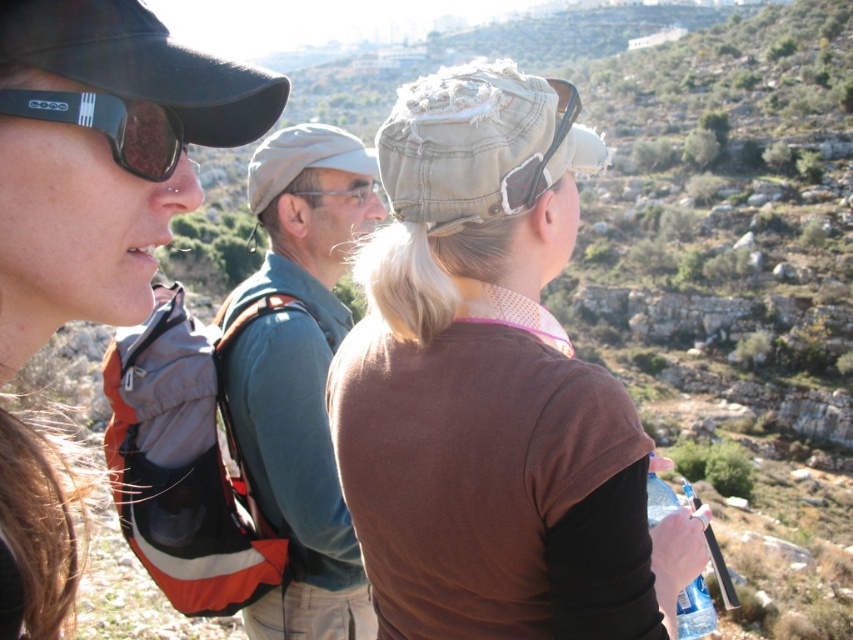
Question: Which of these objects is positioned closest to the light gray fabric cap at center?

Choices:
 (A) clear plastic bottle at lower right
 (B) brown cotton shirt at center
 (C) sunglasses at left

Answer: (B)

Question: Which point is farther from the camera taking this photo?

Choices:
 (A) (357, 611)
 (B) (4, 460)

Answer: (A)

Question: Which object is farther from the camera taking this photo?

Choices:
 (A) clear plastic bottle at lower right
 (B) light gray fabric cap at center

Answer: (B)

Question: Does brown cotton shirt at center appear on the right side of clear plastic bottle at lower right?

Choices:
 (A) no
 (B) yes

Answer: (A)

Question: Observing the image, what is the correct spatial positioning of light gray fabric cap at center in reference to clear plastic bottle at lower right?

Choices:
 (A) right
 (B) left

Answer: (B)

Question: Where is brown cotton shirt at center located in relation to light gray fabric cap at center in the image?

Choices:
 (A) above
 (B) below

Answer: (B)